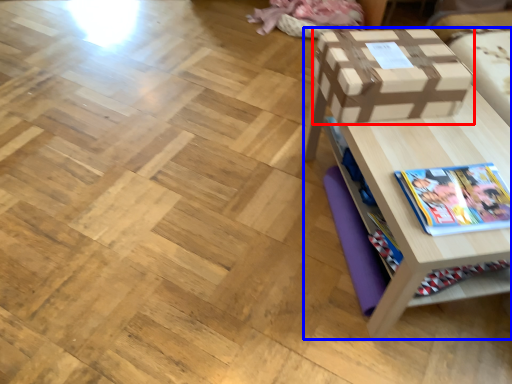
Question: Which object is closer to the camera taking this photo, box (highlighted by a red box) or table (highlighted by a blue box)?

Choices:
 (A) box
 (B) table

Answer: (B)